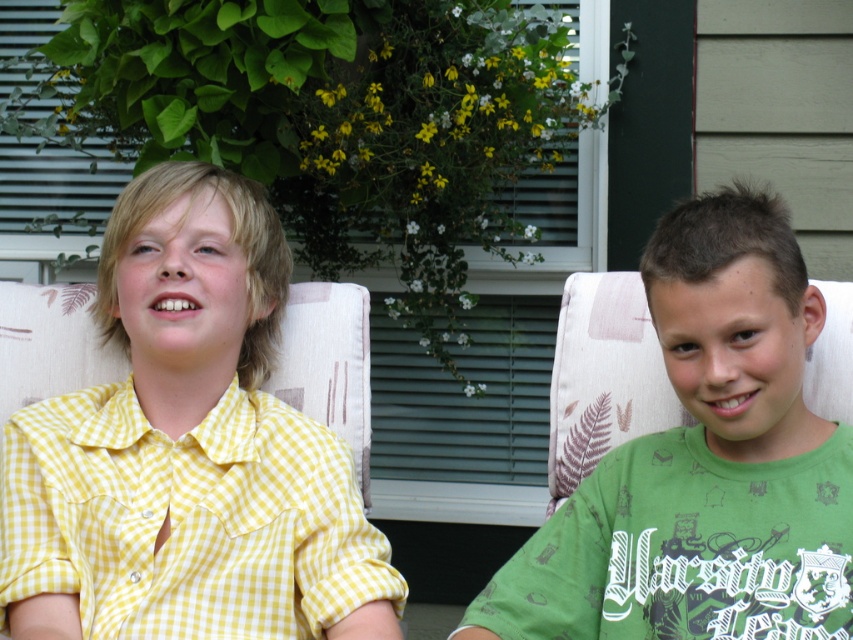
Is green matte shirt at right shorter than green printed t-shirt at right?

No.

Does green matte shirt at right appear over green printed t-shirt at right?

Indeed, green matte shirt at right is positioned over green printed t-shirt at right.

Is point (838, 476) positioned after point (599, 556)?

That is False.

I want to click on green matte shirt at right, so [x=704, y=464].

Who is higher up, green matte shirt at right or yellow checkered shirt at left?

green matte shirt at right

At what (x,y) coordinates should I click in order to perform the action: click on green matte shirt at right. Please return your answer as a coordinate pair (x, y). Image resolution: width=853 pixels, height=640 pixels. Looking at the image, I should click on (704, 464).

Is yellow checkered shirt at left wider than green printed t-shirt at right?

Correct, the width of yellow checkered shirt at left exceeds that of green printed t-shirt at right.

Does yellow checkered shirt at left appear under green printed t-shirt at right?

Actually, yellow checkered shirt at left is above green printed t-shirt at right.

Who is more distant from viewer, [206,490] or [683,474]?

Positioned behind is point [206,490].

I want to click on yellow checkered shirt at left, so click(186, 518).